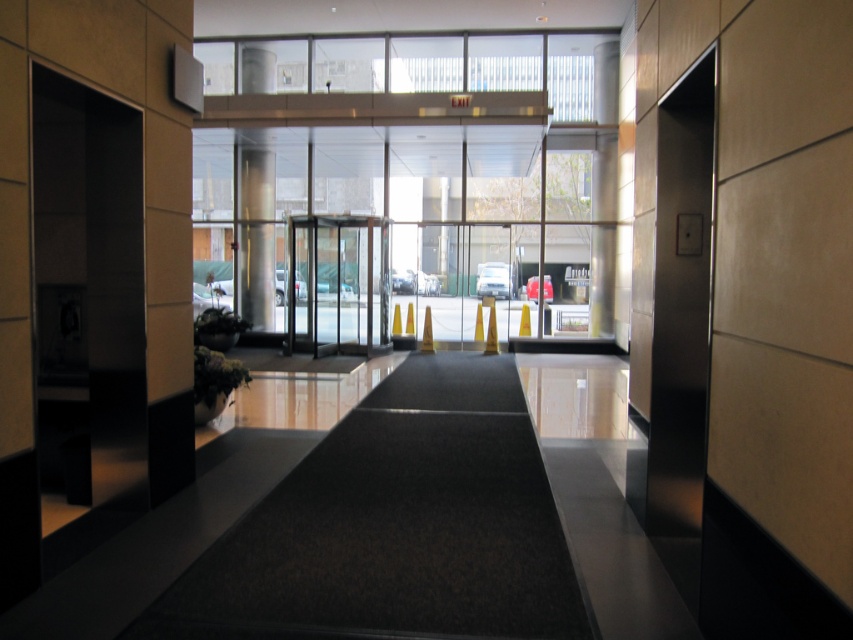
You are standing at the point labeled point at (358,300) and want to reach the revolving door. The building has a strict policy that requires you to stay within 40 feet of the entrance at all times. Can you safely reach the revolving door without violating the policy?

The distance between the point labeled point at (358,300) and the revolving door is 42.32 feet, which exceeds the 40 feet requirement. Therefore, you cannot safely reach the revolving door without violating the building policy.

You are standing at the entrance of the building and see the point marked at coordinates (x=332, y=284). What object is located at that point?

The point at coordinates (x=332, y=284) marks the transparent glass door at center.

You are a delivery person carrying a tall package that is 2 meters in height. You need to pass through the entrance area shown in the image. Which object between the transparent glass door at center and the metallic column at center would block your path due to height restrictions?

The transparent glass door at center is not as tall as the metallic column at center, so the metallic column at center is taller and would block the path of the tall package.